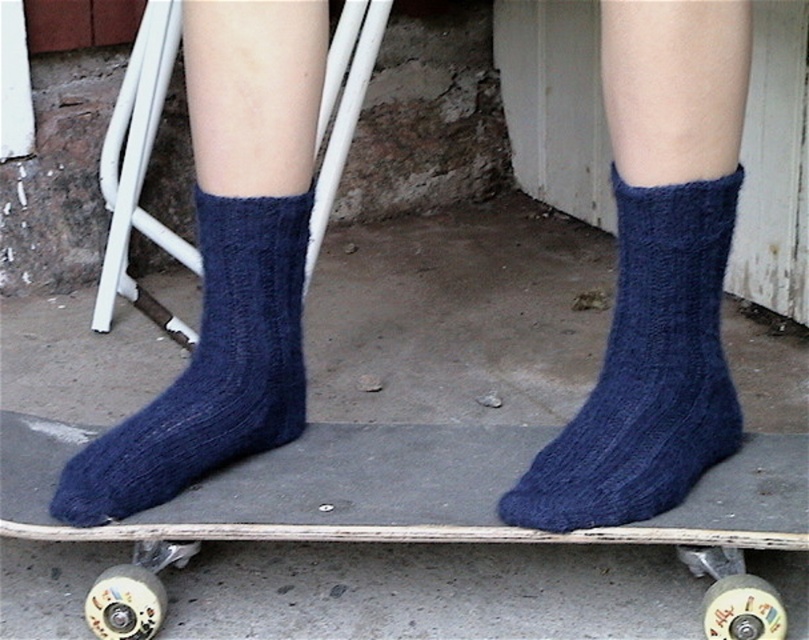
You are a photographer trying to capture both dark blue knitted sock at center and dark blue knitted sock at lower left in a single shot. Based on their positions, which sock should you adjust your camera angle to focus on first to ensure both are in frame?

The dark blue knitted sock at center is to the right of dark blue knitted sock at lower left. To capture both in a single shot, adjust your camera angle to focus on the dark blue knitted sock at lower left first, then pan towards the right to include the other sock.

You are a delivery robot that is 12 inches wide. You need to pass between the navy blue knitted socks at center and the viewer. Is there enough space for you to move through?

The navy blue knitted socks at center and viewer are 28.40 inches apart. Since the robot is 12 inches wide, there is sufficient space to pass between them as 28.40 inches is greater than 12 inches.

You are designing a safety mat for skateboarders. The mat needs to cover the area where the dark blue knitted sock at center is placed. According to the coordinates provided, where should the center of the mat be positioned?

The center of the mat should be positioned at point [647,371] to cover the area where the dark blue knitted sock at center is placed.